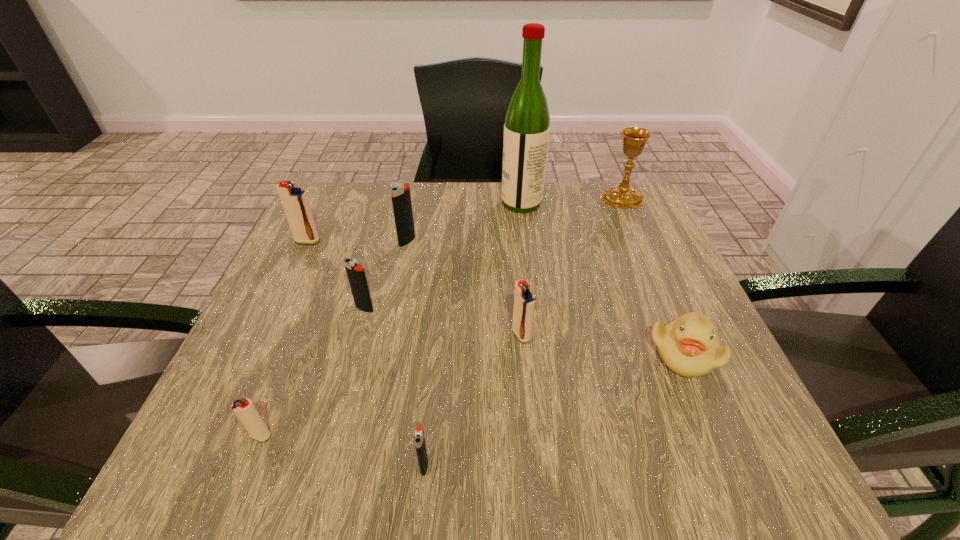
This screenshot has width=960, height=540. Find the location of `vacant region between the duckling and the second nearest igniter`. vacant region between the duckling and the second nearest igniter is located at coordinates (471, 394).

You are a GUI agent. You are given a task and a screenshot of the screen. Output one action in this format:
    pyautogui.click(x=<x>, y=<y>)
    Task: Click on the object that stands as the eighth closest to the leftmost object
    Image resolution: width=960 pixels, height=540 pixels.
    Given the screenshot: What is the action you would take?
    pyautogui.click(x=687, y=345)

This screenshot has height=540, width=960. In order to click on object that stands as the closest to the leftmost black igniter in this screenshot , I will do `click(400, 193)`.

You are a GUI agent. You are given a task and a screenshot of the screen. Output one action in this format:
    pyautogui.click(x=<x>, y=<y>)
    Task: Click on the closest igniter to the duckling
    This screenshot has width=960, height=540.
    Given the screenshot: What is the action you would take?
    pyautogui.click(x=524, y=301)

Locate which igniter is the closest to the nearest black igniter. Please provide its 2D coordinates. Your answer should be formatted as a tuple, i.e. [(x, y)], where the tuple contains the x and y coordinates of a point satisfying the conditions above.

[(245, 411)]

Locate an element on the screen. The image size is (960, 540). the second closest red igniter to the gold chalice is located at coordinates (295, 203).

Identify the location of red igniter that stands as the second closest to the liquor. [x=295, y=203].

Find the location of a particular element. This screenshot has width=960, height=540. black igniter that is the closest one to the nearest black igniter is located at coordinates (356, 275).

Where is `black igniter that can be found as the closest to the nearest black igniter`? black igniter that can be found as the closest to the nearest black igniter is located at coordinates (356, 275).

Where is `free region that satisfies the following two spatial constraints: 1. on the front side of the third object from left to right; 2. on the left side of the leftmost igniter`? The height and width of the screenshot is (540, 960). free region that satisfies the following two spatial constraints: 1. on the front side of the third object from left to right; 2. on the left side of the leftmost igniter is located at coordinates (275, 309).